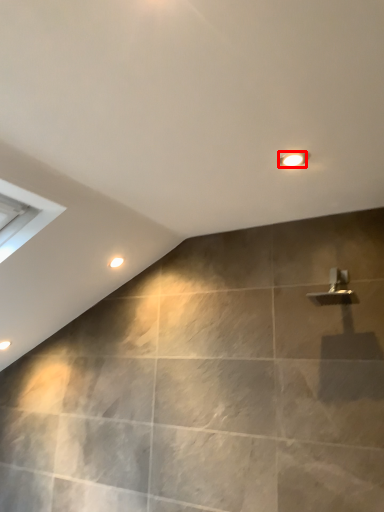
Question: From the image's perspective, where is light fixture (annotated by the red box) located relative to droplight?

Choices:
 (A) above
 (B) below

Answer: (A)